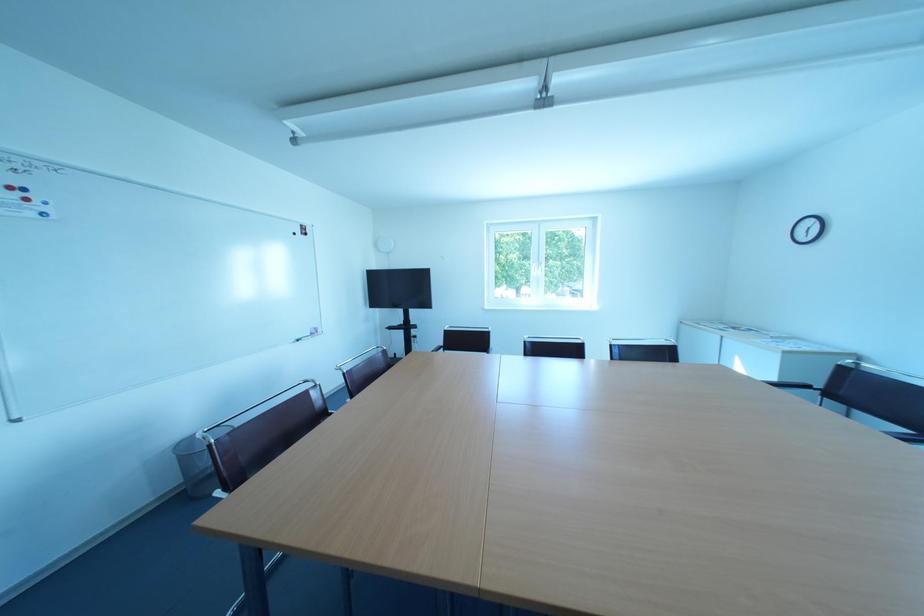
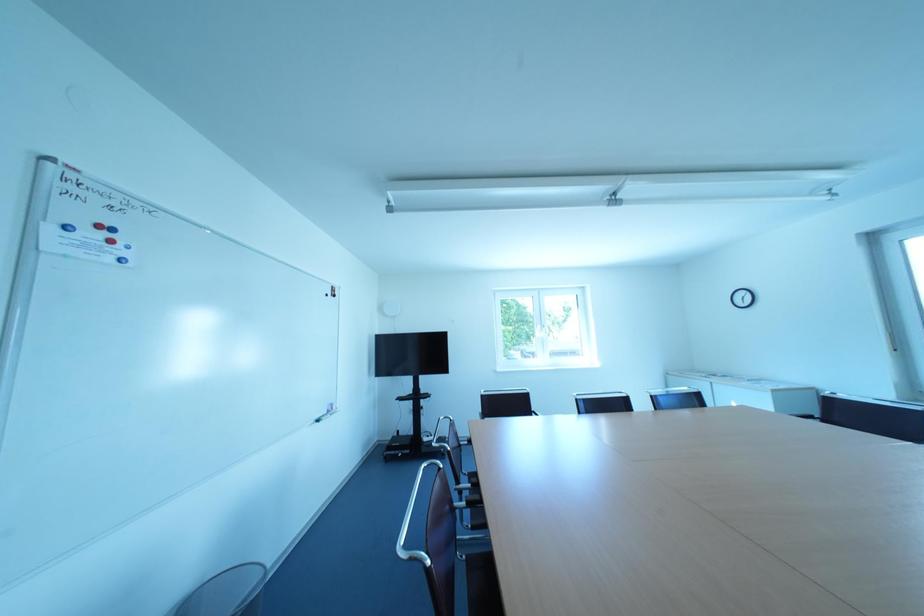
Question: In a continuous first-person perspective shot, in which direction is the camera moving?

Choices:
 (A) Left
 (B) Right
 (C) Forward
 (D) Backward

Answer: (A)